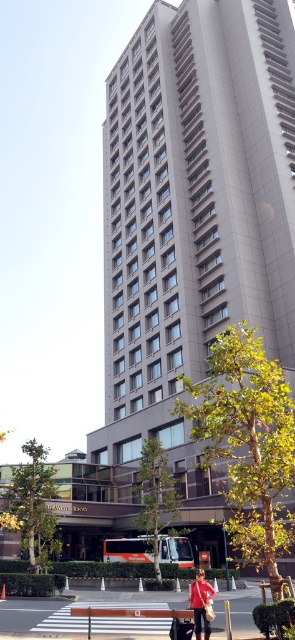
Question: Does smooth asphalt pavement at lower center appear under matte red jacket at center?

Choices:
 (A) no
 (B) yes

Answer: (B)

Question: Which of the following is the farthest from the observer?

Choices:
 (A) smooth asphalt pavement at lower center
 (B) gray concrete building at center

Answer: (B)

Question: Is gray concrete building at center bigger than matte red jacket at center?

Choices:
 (A) yes
 (B) no

Answer: (A)

Question: Does gray concrete building at center have a smaller size compared to smooth asphalt pavement at lower center?

Choices:
 (A) yes
 (B) no

Answer: (B)

Question: Which point appears closest to the camera in this image?

Choices:
 (A) (159, 598)
 (B) (200, 596)

Answer: (B)

Question: Which object is closer to the camera taking this photo?

Choices:
 (A) smooth asphalt pavement at lower center
 (B) matte red jacket at center

Answer: (B)